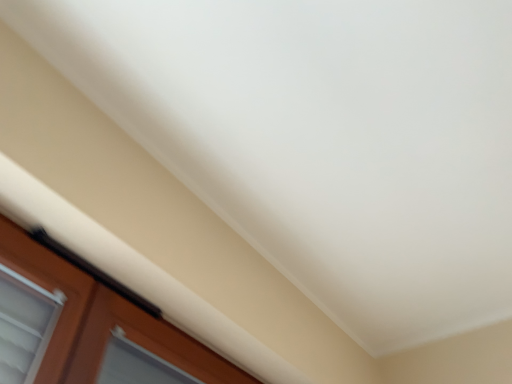
Find the location of `brown wooden window at lower left`. brown wooden window at lower left is located at coordinates (86, 328).

Image resolution: width=512 pixels, height=384 pixels. What do you see at coordinates (86, 328) in the screenshot?
I see `brown wooden window at lower left` at bounding box center [86, 328].

You are a GUI agent. You are given a task and a screenshot of the screen. Output one action in this format:
    pyautogui.click(x=<x>, y=<y>)
    Task: Click on the brown wooden window at lower left
    Image resolution: width=512 pixels, height=384 pixels.
    Given the screenshot: What is the action you would take?
    pyautogui.click(x=86, y=328)